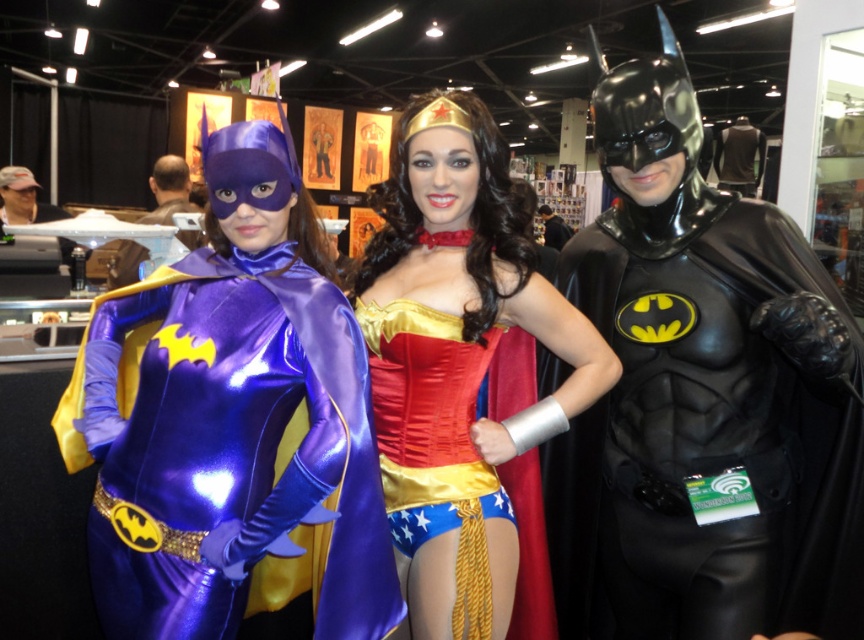
Question: Which object appears farthest from the camera in this image?

Choices:
 (A) shiny purple costume at left
 (B) black glossy batman costume at right
 (C) satin gold corset at center

Answer: (C)

Question: Is black glossy batman costume at right smaller than shiny purple costume at left?

Choices:
 (A) no
 (B) yes

Answer: (A)

Question: Considering the real-world distances, which object is farthest from the satin gold corset at center?

Choices:
 (A) black glossy batman costume at right
 (B) shiny purple costume at left

Answer: (B)

Question: Based on their relative distances, which object is farther from the satin gold corset at center?

Choices:
 (A) black glossy batman costume at right
 (B) shiny purple costume at left

Answer: (B)

Question: Does black glossy batman costume at right appear under shiny purple costume at left?

Choices:
 (A) no
 (B) yes

Answer: (A)

Question: Is shiny purple costume at left above satin gold corset at center?

Choices:
 (A) yes
 (B) no

Answer: (B)